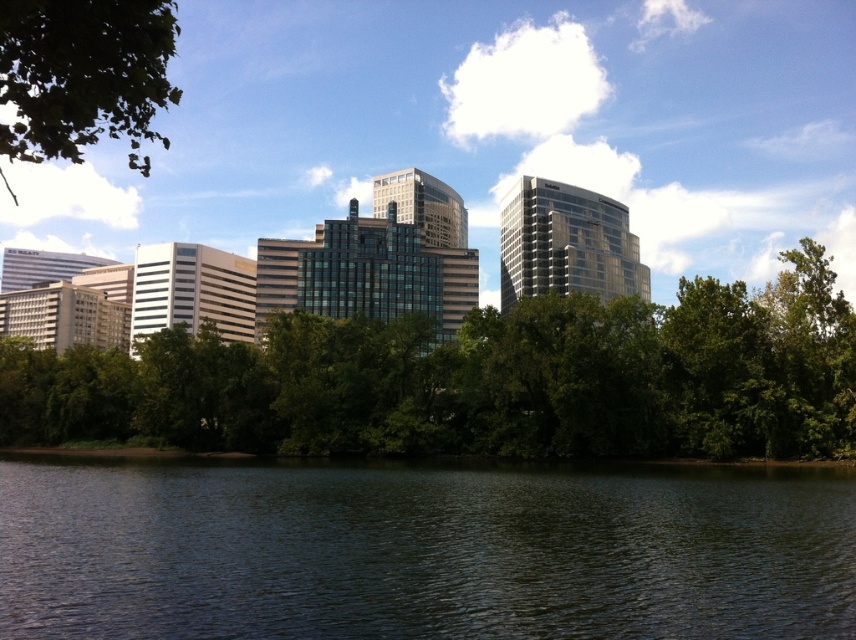
Which is behind, point (709, 445) or point (82, 49)?

The point (709, 445) is more distant.

Is point (248, 404) less distant than point (52, 8)?

No, it is not.

You are a GUI agent. You are given a task and a screenshot of the screen. Output one action in this format:
    pyautogui.click(x=<x>, y=<y>)
    Task: Click on the green leafy trees at center
    The image size is (856, 640).
    Given the screenshot: What is the action you would take?
    pyautogui.click(x=479, y=380)

Who is higher up, dark green water at lower center or green leafy trees at center?

Positioned higher is green leafy trees at center.

Between dark green water at lower center and green leafy trees at center, which one has less height?

With less height is dark green water at lower center.

Which is in front, point (657, 547) or point (675, 429)?

Point (657, 547)

Image resolution: width=856 pixels, height=640 pixels. Identify the location of dark green water at lower center. (421, 552).

Between dark green water at lower center and green leafy tree at upper left, which one is positioned higher?

green leafy tree at upper left is above.

Does dark green water at lower center have a smaller size compared to green leafy tree at upper left?

Yes.

This screenshot has height=640, width=856. I want to click on dark green water at lower center, so click(421, 552).